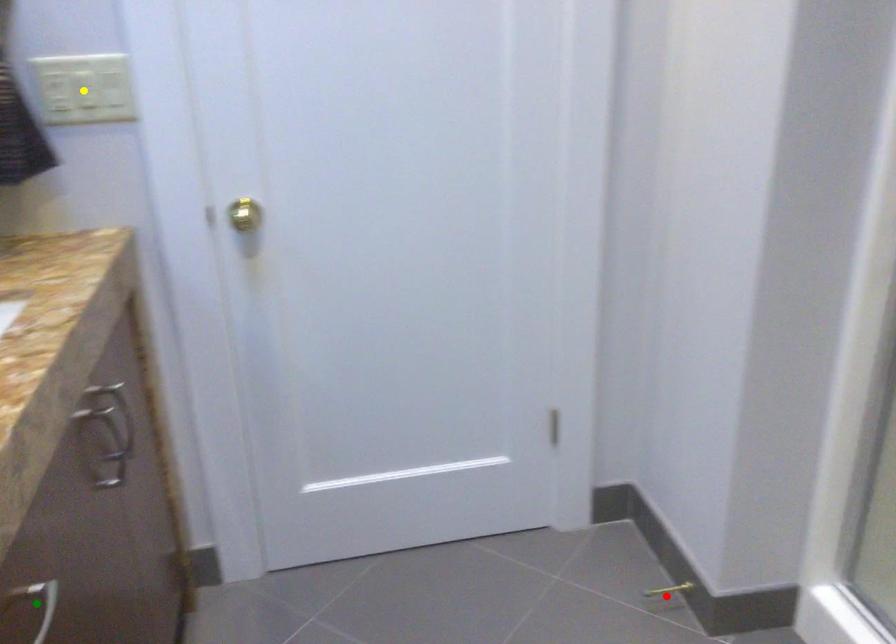
Order these from farthest to nearest:
yellow point, red point, green point

red point < yellow point < green point